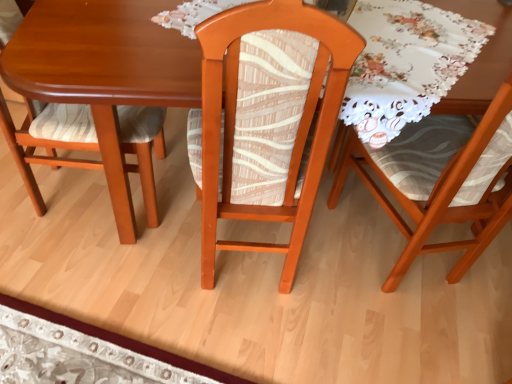
Question: Considering the relative positions of wooden table at center and wooden chair at center, marked as the second chair in a left-to-right arrangement, in the image provided, is wooden table at center to the right of wooden chair at center, marked as the second chair in a left-to-right arrangement, from the viewer's perspective?

Choices:
 (A) yes
 (B) no

Answer: (A)

Question: Is wooden table at center positioned with its back to wooden chair at center, marked as the second chair in a left-to-right arrangement?

Choices:
 (A) no
 (B) yes

Answer: (A)

Question: From a real-world perspective, is wooden table at center positioned under wooden chair at center, which appears as the second chair when viewed from the right, based on gravity?

Choices:
 (A) no
 (B) yes

Answer: (A)

Question: Considering the relative sizes of wooden table at center and wooden chair at center, which appears as the second chair when viewed from the right, in the image provided, is wooden table at center taller than wooden chair at center, which appears as the second chair when viewed from the right,?

Choices:
 (A) no
 (B) yes

Answer: (A)

Question: Is wooden chair at center, marked as the second chair in a left-to-right arrangement, inside wooden table at center?

Choices:
 (A) no
 (B) yes

Answer: (A)

Question: Is wooden table at center thinner than wooden chair at center, which appears as the second chair when viewed from the right?

Choices:
 (A) no
 (B) yes

Answer: (A)

Question: From the image's perspective, is wooden chair at right, which ranks as the 3th chair in left-to-right order, under wooden chair at center, which appears as the second chair when viewed from the right?

Choices:
 (A) no
 (B) yes

Answer: (B)

Question: Does wooden chair at right, positioned as the 1th chair in right-to-left order, contain wooden chair at center, marked as the second chair in a left-to-right arrangement?

Choices:
 (A) no
 (B) yes

Answer: (A)

Question: Is wooden chair at right, which ranks as the 3th chair in left-to-right order, wider than wooden chair at center, marked as the second chair in a left-to-right arrangement?

Choices:
 (A) yes
 (B) no

Answer: (A)

Question: Does wooden chair at right, positioned as the 1th chair in right-to-left order, turn towards wooden chair at center, marked as the second chair in a left-to-right arrangement?

Choices:
 (A) yes
 (B) no

Answer: (B)

Question: Is wooden chair at right, positioned as the 1th chair in right-to-left order, thinner than wooden chair at center, which appears as the second chair when viewed from the right?

Choices:
 (A) no
 (B) yes

Answer: (A)

Question: From a real-world perspective, is wooden chair at right, which ranks as the 3th chair in left-to-right order, beneath wooden chair at center, marked as the second chair in a left-to-right arrangement?

Choices:
 (A) no
 (B) yes

Answer: (A)

Question: Does wooden table at center appear on the right side of matte wood chair at left, the 1th chair in the left-to-right sequence?

Choices:
 (A) yes
 (B) no

Answer: (A)